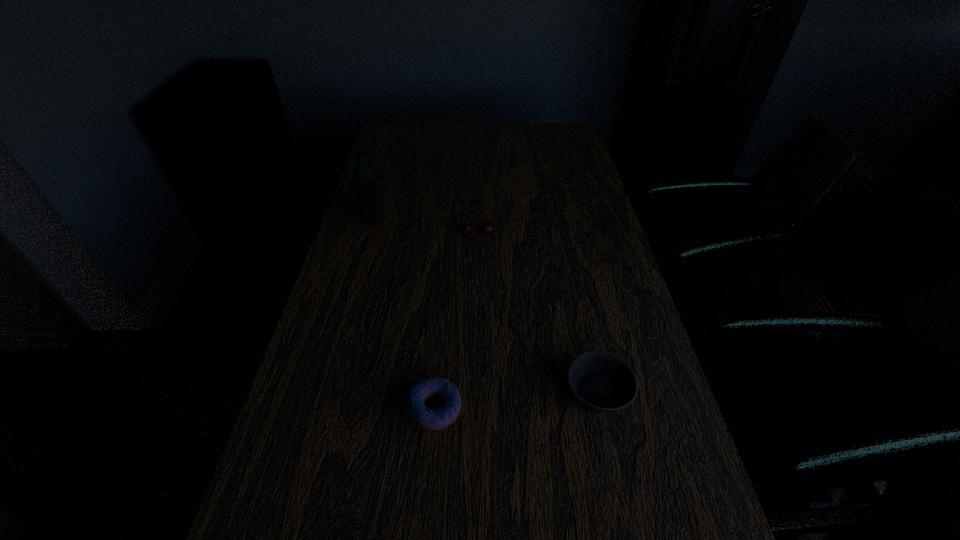
Locate an element on the screen. The height and width of the screenshot is (540, 960). vacant space that satisfies the following two spatial constraints: 1. with stems pointing upwards on the bowl; 2. on the left side of the second tallest object is located at coordinates (476, 392).